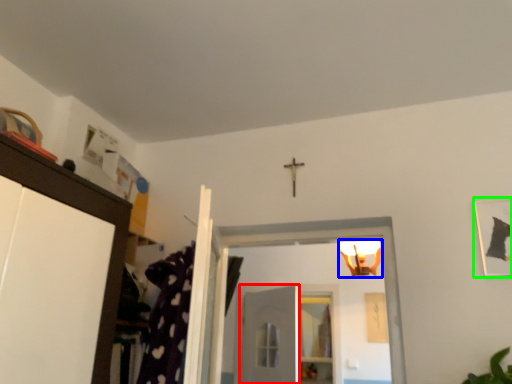
Question: Estimate the real-world distances between objects in this image. Which object is closer to door (highlighted by a red box), light fixture (highlighted by a blue box) or picture frame (highlighted by a green box)?

Choices:
 (A) light fixture
 (B) picture frame

Answer: (A)